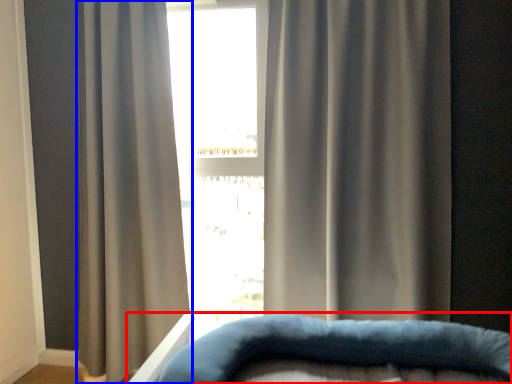
Question: Which of the following is the closest to the observer, furniture (highlighted by a red box) or curtain (highlighted by a blue box)?

Choices:
 (A) furniture
 (B) curtain

Answer: (A)